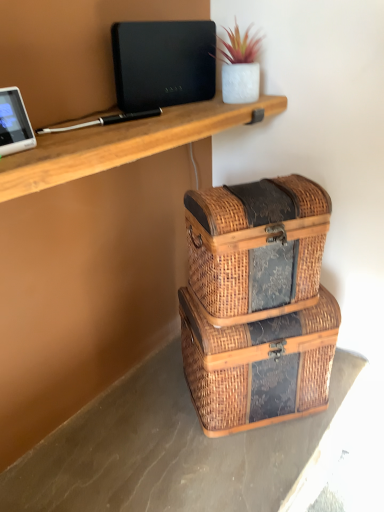
You are a GUI agent. You are given a task and a screenshot of the screen. Output one action in this format:
    pyautogui.click(x=<x>, y=<y>)
    Task: Click on the free point to the left of woven wood storage box at lower center, the 1th storage box ordered from the bottom
    The height and width of the screenshot is (512, 384).
    Given the screenshot: What is the action you would take?
    pyautogui.click(x=151, y=410)